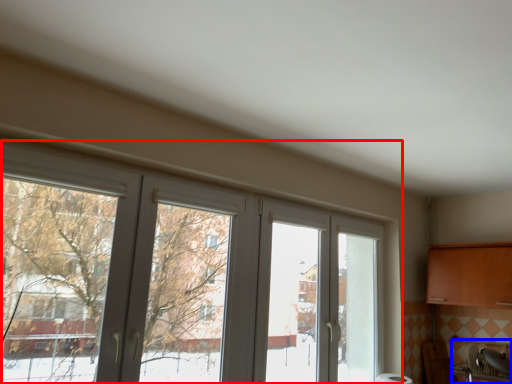
Question: Which object is closer to the camera taking this photo, window (highlighted by a red box) or sink (highlighted by a blue box)?

Choices:
 (A) window
 (B) sink

Answer: (A)